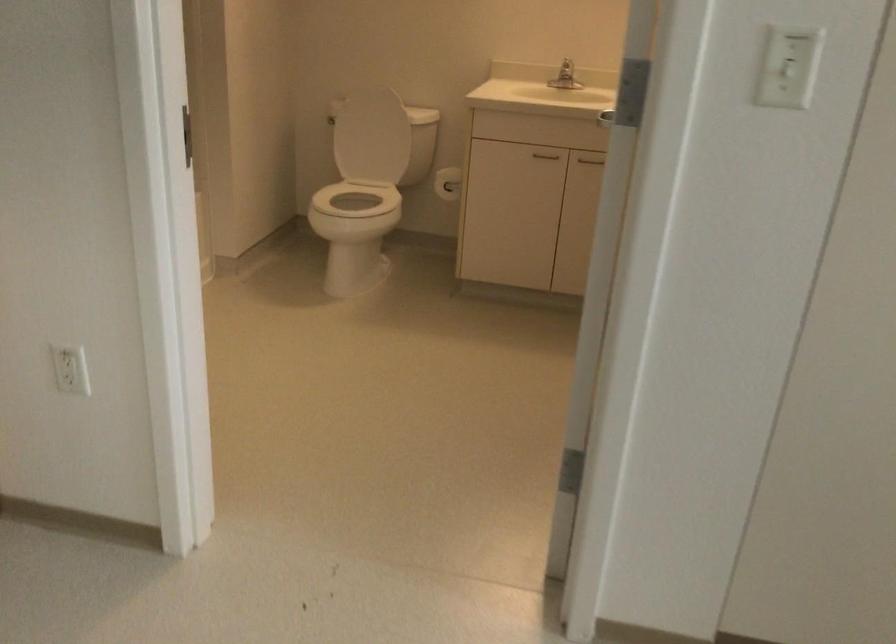
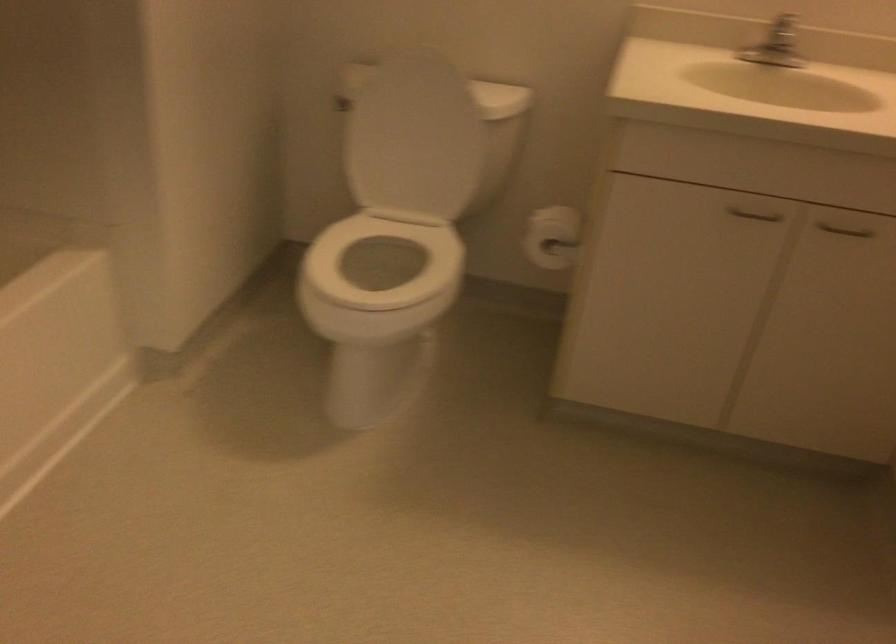
In the second image, find the point that corresponds to the point at 449,180 in the first image.

(552, 237)